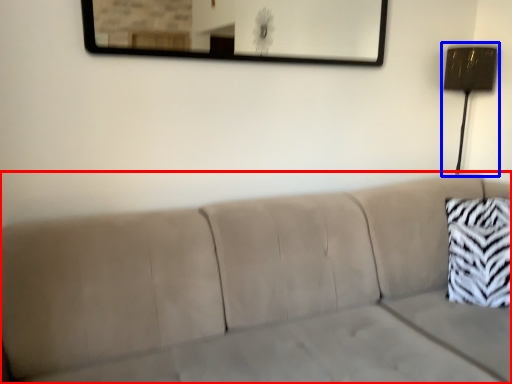
Question: Which object is further to the camera taking this photo, studio couch (highlighted by a red box) or lamp (highlighted by a blue box)?

Choices:
 (A) studio couch
 (B) lamp

Answer: (B)